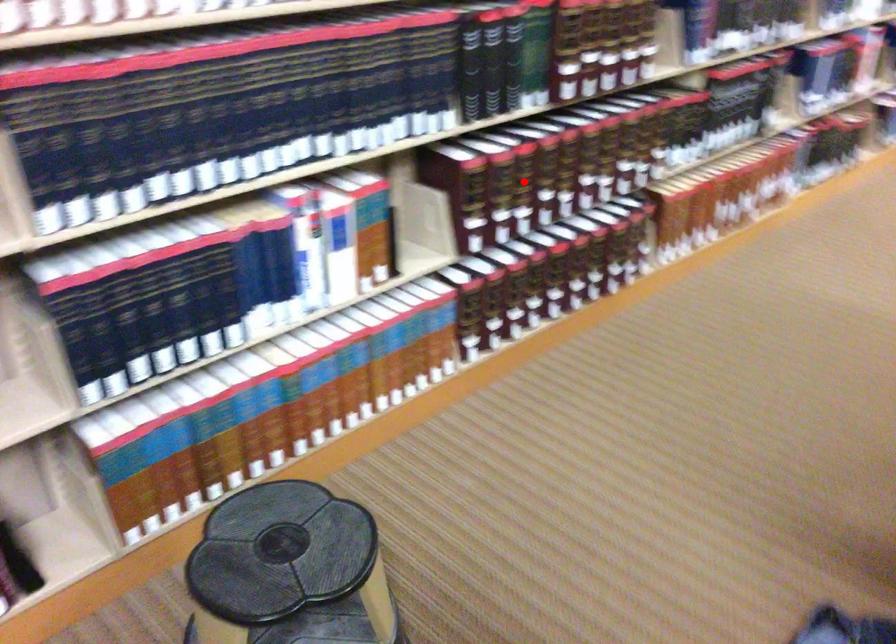
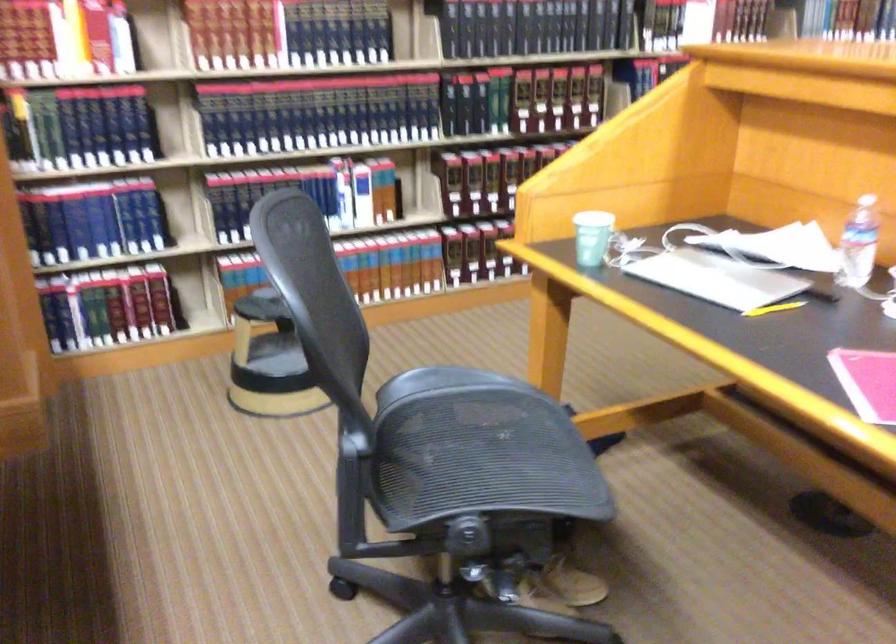
Question: I am providing you with two images of the same scene from different viewpoints. Given a red point in image1, look at the same physical point in image2. Is it:

Choices:
 (A) Closer to the viewpoint
 (B) Farther from the viewpoint

Answer: (B)